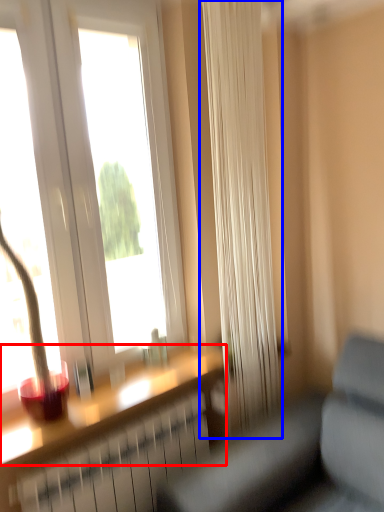
Question: Among these objects, which one is farthest to the camera, window sill (highlighted by a red box) or curtain (highlighted by a blue box)?

Choices:
 (A) window sill
 (B) curtain

Answer: (B)